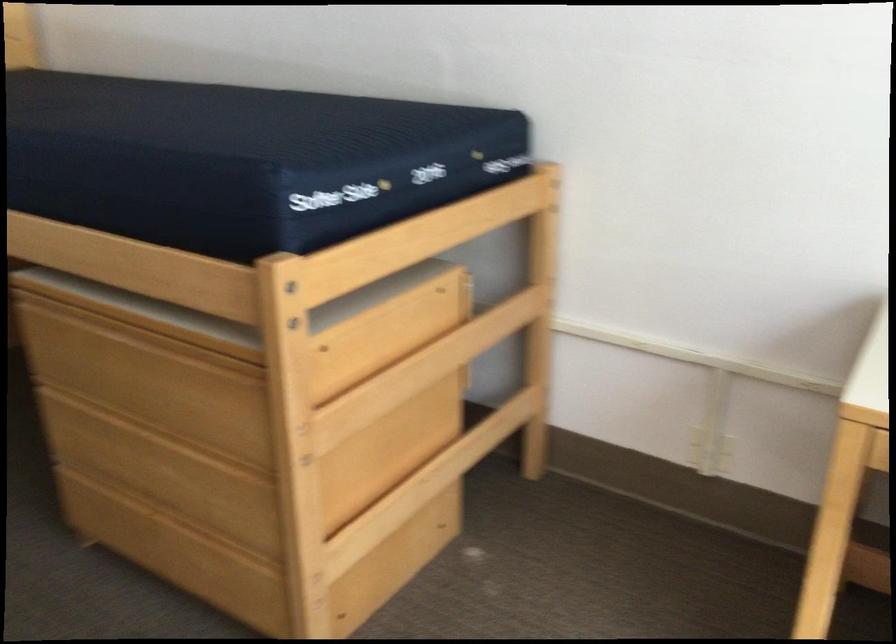
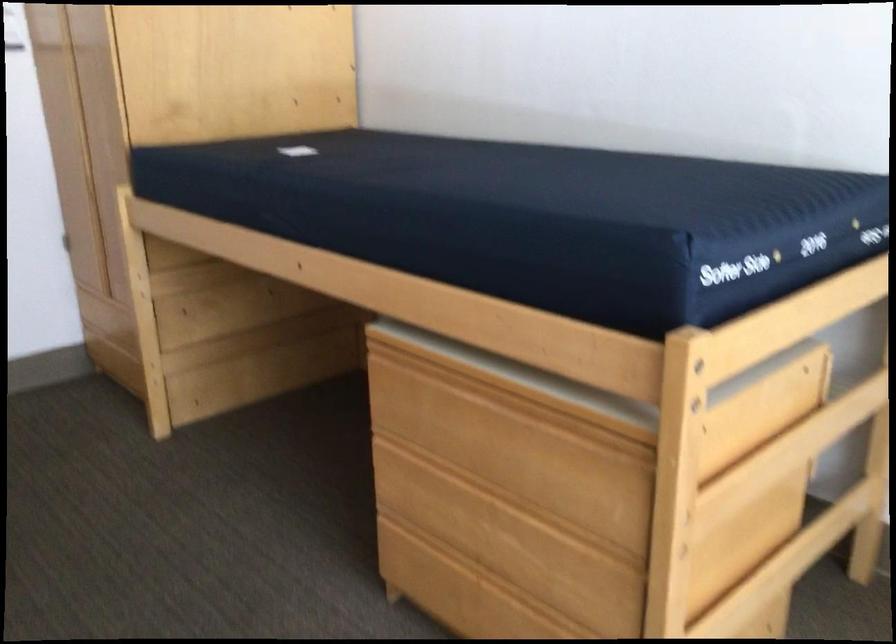
The point at (426, 365) is marked in the first image. Where is the corresponding point in the second image?

(789, 451)